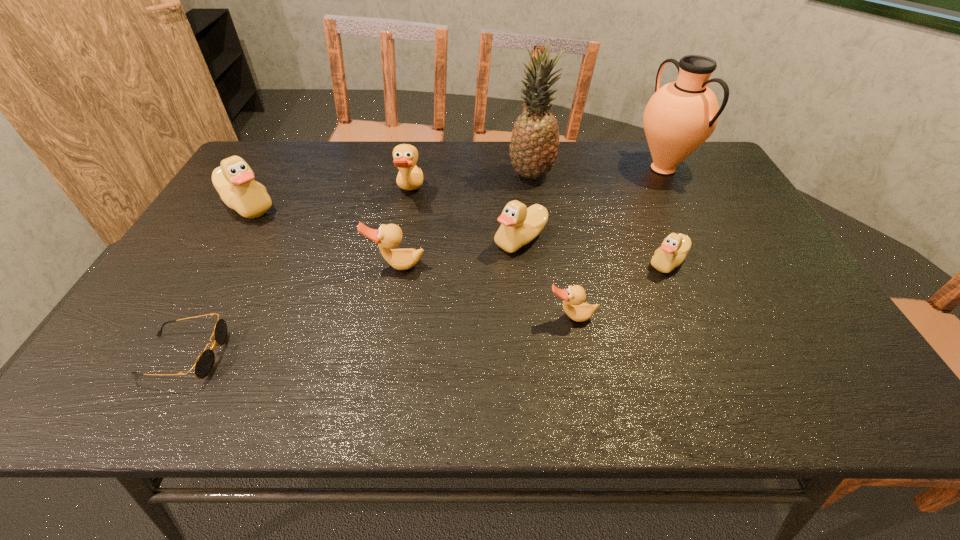
Find the location of a particular element. This screenshot has width=960, height=540. free location that satisfies the following two spatial constraints: 1. on the beak of the nearest tan duck; 2. on the front-facing side of the sunglasses is located at coordinates (579, 355).

Where is `vacant point that satisfies the following two spatial constraints: 1. at the beak of the rightmost beige duck; 2. on the beak of the nearest tan duck`? This screenshot has height=540, width=960. vacant point that satisfies the following two spatial constraints: 1. at the beak of the rightmost beige duck; 2. on the beak of the nearest tan duck is located at coordinates (691, 317).